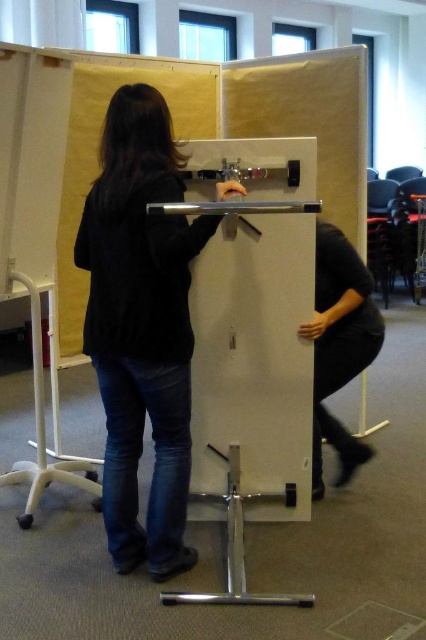
Question: Which point is farther to the camera?

Choices:
 (A) black matte shirt at right
 (B) black matte sweater at center
 (C) white matte easel at center

Answer: (A)

Question: Does black matte sweater at center have a smaller size compared to black matte shirt at right?

Choices:
 (A) yes
 (B) no

Answer: (B)

Question: Which object appears farthest from the camera in this image?

Choices:
 (A) white matte easel at center
 (B) black matte sweater at center
 (C) black matte shirt at right

Answer: (C)

Question: Considering the relative positions of white matte easel at center and black matte sweater at center in the image provided, where is white matte easel at center located with respect to black matte sweater at center?

Choices:
 (A) below
 (B) above

Answer: (A)

Question: Which point is farther to the camera?

Choices:
 (A) black matte sweater at center
 (B) white matte easel at center

Answer: (B)

Question: Does black matte sweater at center appear over black matte shirt at right?

Choices:
 (A) no
 (B) yes

Answer: (B)